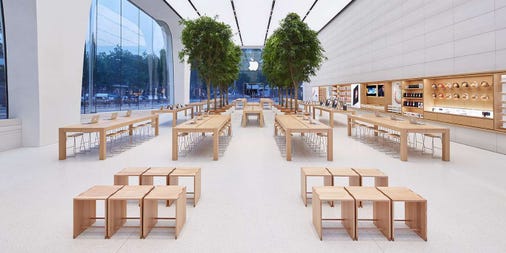
Identify the location of poster. The width and height of the screenshot is (506, 253). (353, 95).